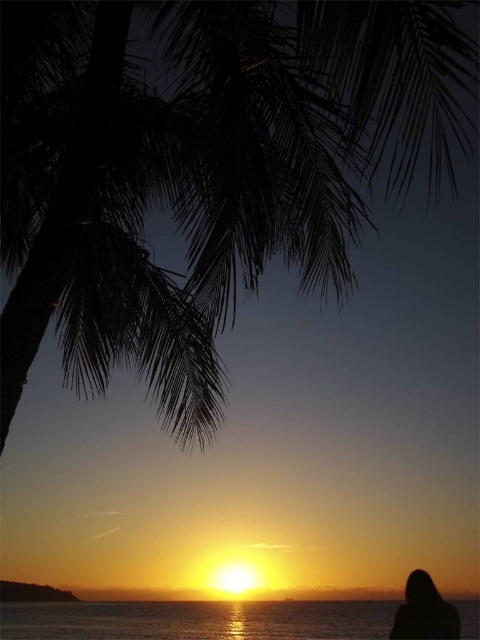
Who is taller, silhouette leafy palm at upper left or shiny silver water at lower center?

With more height is shiny silver water at lower center.

Is silhouette leafy palm at upper left positioned in front of shiny silver water at lower center?

Yes, it is.

Locate an element on the screen. This screenshot has height=640, width=480. silhouette leafy palm at upper left is located at coordinates (204, 168).

Where is `silhouette leafy palm at upper left`? The height and width of the screenshot is (640, 480). silhouette leafy palm at upper left is located at coordinates click(x=204, y=168).

Does silhouette leafy palm at upper left appear on the right side of black matte hair at lower right?

Incorrect, silhouette leafy palm at upper left is not on the right side of black matte hair at lower right.

Can you confirm if silhouette leafy palm at upper left is positioned above black matte hair at lower right?

Correct, silhouette leafy palm at upper left is located above black matte hair at lower right.

Does point (74, 225) come behind point (451, 627)?

No, it is not.

Image resolution: width=480 pixels, height=640 pixels. Find the location of `silhouette leafy palm at upper left`. silhouette leafy palm at upper left is located at coordinates (204, 168).

Who is more forward, (115, 611) or (406, 604)?

Positioned in front is point (406, 604).

Is shiny silver water at lower center taller than black matte hair at lower right?

Correct, shiny silver water at lower center is much taller as black matte hair at lower right.

Locate an element on the screen. Image resolution: width=480 pixels, height=640 pixels. shiny silver water at lower center is located at coordinates (197, 620).

You are a GUI agent. You are given a task and a screenshot of the screen. Output one action in this format:
    pyautogui.click(x=<x>, y=<y>)
    Task: Click on the shiny silver water at lower center
    This screenshot has width=480, height=640.
    Given the screenshot: What is the action you would take?
    pyautogui.click(x=197, y=620)